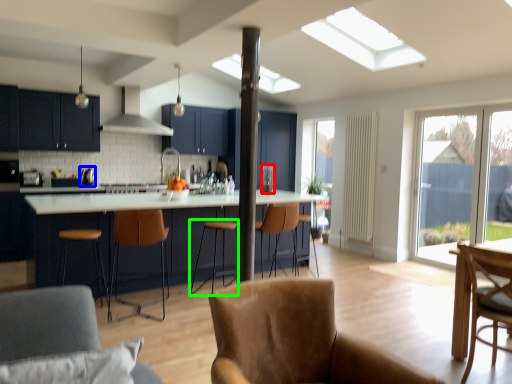
Question: Based on their relative distances, which object is nearer to appliance (highlighted by a red box)? Choose from appliance (highlighted by a blue box) and bar stool (highlighted by a green box).

Choices:
 (A) appliance
 (B) bar stool

Answer: (B)